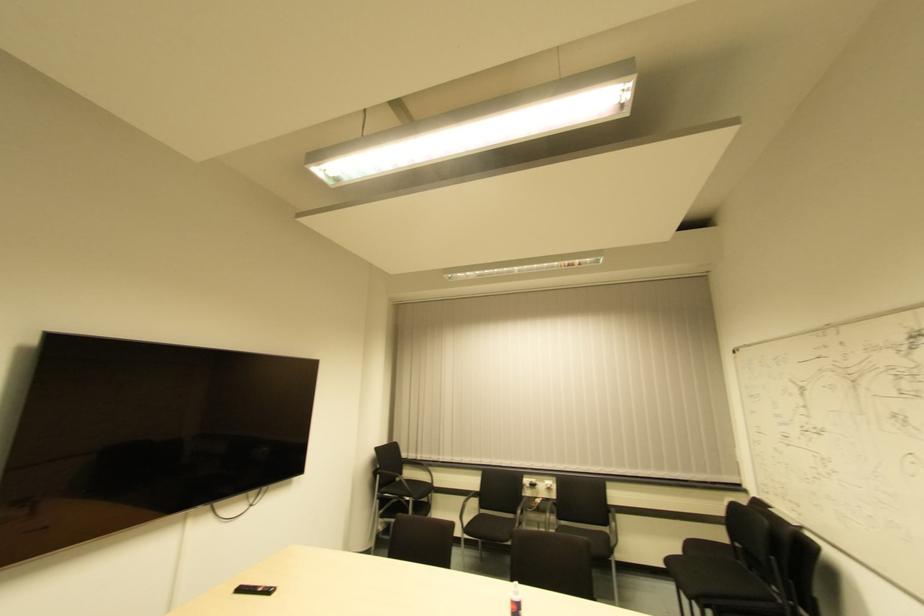
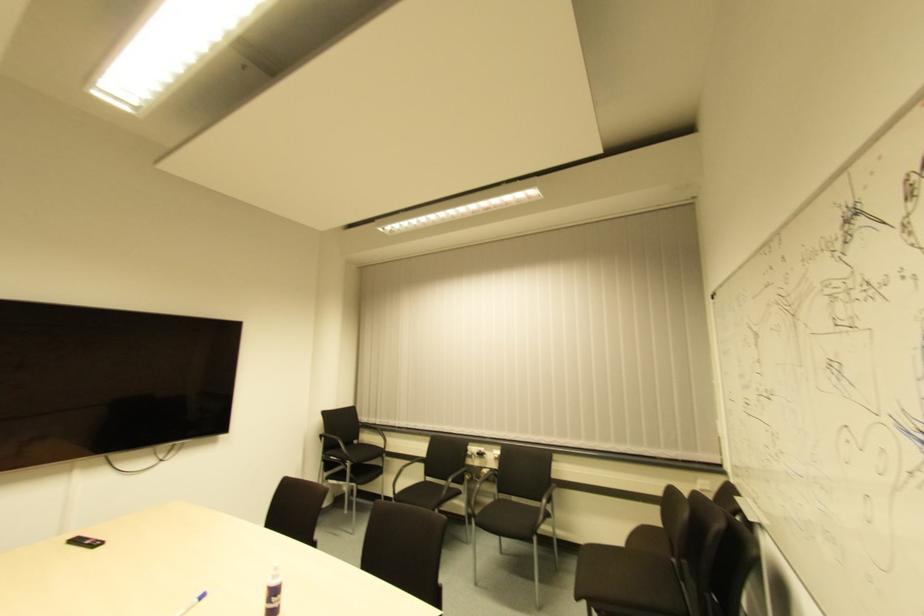
Locate, in the second image, the point that corresponds to [537,504] in the first image.

(483, 474)